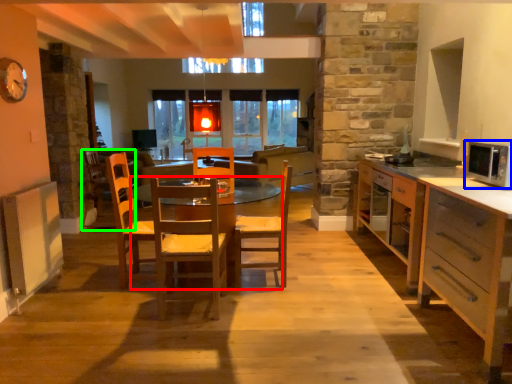
Question: Based on their relative distances, which object is farther from table (highlighted by a red box)? Choose from microwave oven (highlighted by a blue box) and armchair (highlighted by a green box).

Choices:
 (A) microwave oven
 (B) armchair

Answer: (A)